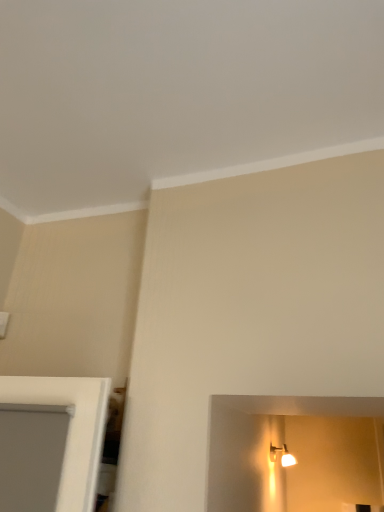
Identify the location of matte white light fixture at upper right. This screenshot has width=384, height=512. (282, 456).

What do you see at coordinates (282, 456) in the screenshot?
I see `matte white light fixture at upper right` at bounding box center [282, 456].

Measure the distance between matte white light fixture at upper right and camera.

2.71 meters.

Find the location of `matte white light fixture at upper right`. matte white light fixture at upper right is located at coordinates [282, 456].